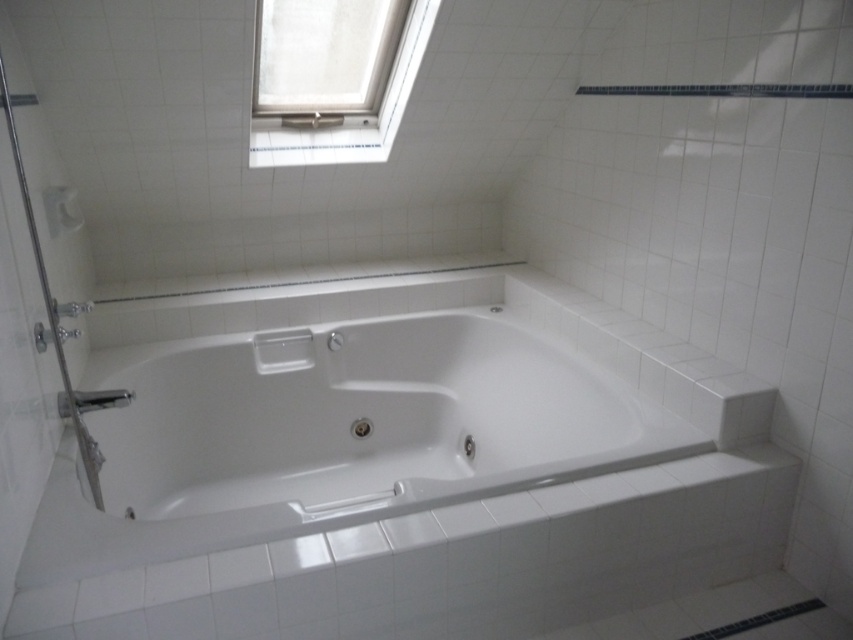
Question: Which of the following is the farthest from the observer?

Choices:
 (A) (286, 147)
 (B) (569, 397)
 (C) (82, 394)

Answer: (A)

Question: Can you confirm if white plastic window at upper center is thinner than satin nickel faucet at lower left?

Choices:
 (A) no
 (B) yes

Answer: (A)

Question: Can you confirm if white glossy bathtub at center is positioned above satin nickel faucet at lower left?

Choices:
 (A) yes
 (B) no

Answer: (B)

Question: Does white glossy bathtub at center come behind satin nickel faucet at lower left?

Choices:
 (A) no
 (B) yes

Answer: (A)

Question: Among these objects, which one is nearest to the camera?

Choices:
 (A) white plastic window at upper center
 (B) white glossy bathtub at center

Answer: (B)

Question: Which point appears closest to the camera in this image?

Choices:
 (A) (64, 404)
 (B) (74, 492)
 (C) (392, 141)

Answer: (B)